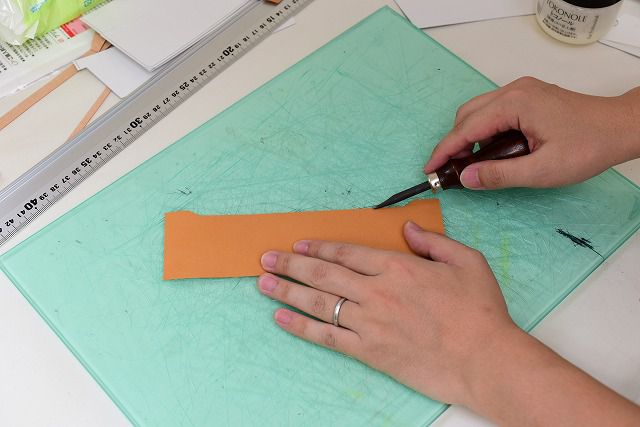
Image resolution: width=640 pixels, height=427 pixels. In order to click on cutting board in this screenshot , I will do `click(237, 334)`.